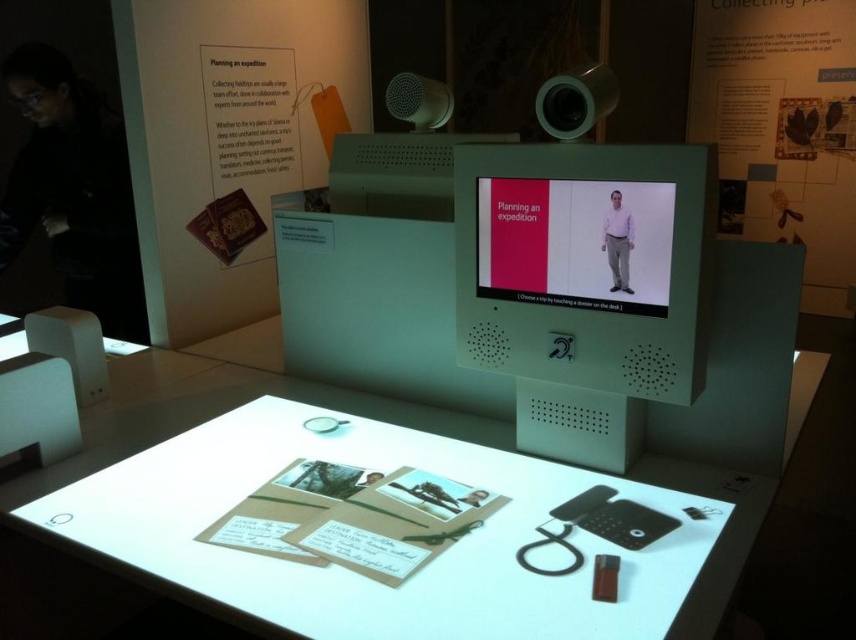
Between black fabric at left and matte plastic screen at center, which one appears on the left side from the viewer's perspective?

black fabric at left is more to the left.

Can you confirm if black fabric at left is positioned above matte plastic screen at center?

Yes.

Which is behind, point (22, 236) or point (510, 244)?

The point (22, 236) is more distant.

I want to click on black fabric at left, so click(x=73, y=189).

Can you confirm if matte plastic monitor at center is smaller than matte purple shirt at center?

Actually, matte plastic monitor at center might be larger than matte purple shirt at center.

Between matte plastic monitor at center and matte purple shirt at center, which one appears on the left side from the viewer's perspective?

matte plastic monitor at center is more to the left.

Image resolution: width=856 pixels, height=640 pixels. What are the coordinates of `matte plastic monitor at center` in the screenshot? It's located at (581, 264).

Is white glossy table at center further to camera compared to black fabric at left?

No, it is not.

Identify the location of white glossy table at center. This screenshot has height=640, width=856. point(188,420).